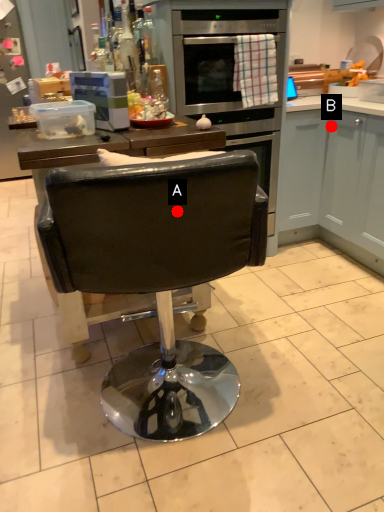
Question: Two points are circled on the image, labeled by A and B beside each circle. Which of the following is the farthest from the observer?

Choices:
 (A) A is further
 (B) B is further

Answer: (B)